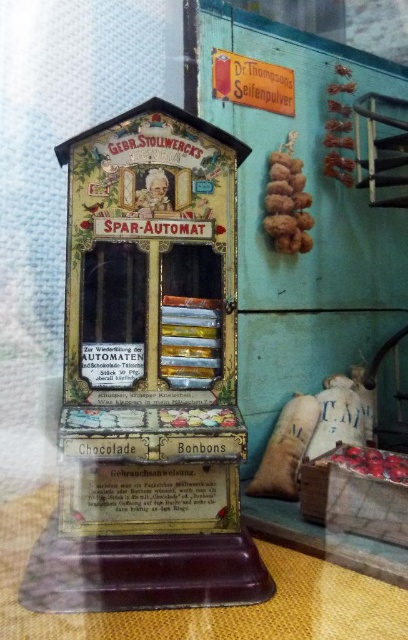
Question: Does shiny metallic automat at center have a lesser width compared to matte yellow sign at upper center?

Choices:
 (A) yes
 (B) no

Answer: (B)

Question: Among these points, which one is farthest from the camera?

Choices:
 (A) (81, 451)
 (B) (237, 67)

Answer: (B)

Question: Among these points, which one is farthest from the camera?

Choices:
 (A) (244, 104)
 (B) (104, 416)

Answer: (A)

Question: Observing the image, what is the correct spatial positioning of shiny metallic automat at center in reference to matte yellow sign at upper center?

Choices:
 (A) left
 (B) right

Answer: (A)

Question: Does shiny metallic automat at center lie in front of matte yellow sign at upper center?

Choices:
 (A) no
 (B) yes

Answer: (B)